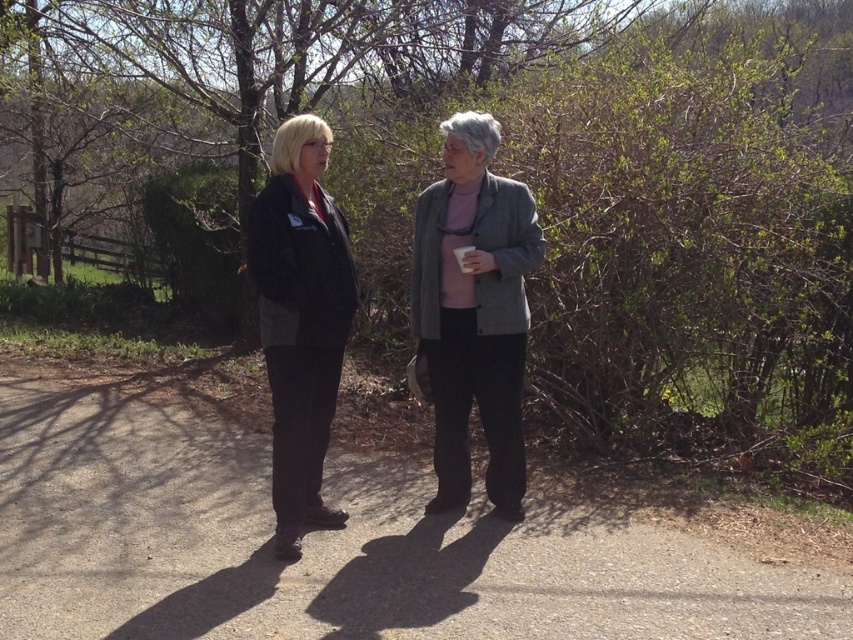
Question: Which point is farther to the camera?

Choices:
 (A) black matte suit at center
 (B) gray woolen blazer at center
 (C) gray asphalt path at center

Answer: (B)

Question: In this image, where is gray asphalt path at center located relative to black matte suit at center?

Choices:
 (A) left
 (B) right

Answer: (B)

Question: Is gray woolen blazer at center thinner than black matte suit at center?

Choices:
 (A) no
 (B) yes

Answer: (A)

Question: Among these points, which one is nearest to the camera?

Choices:
 (A) (16, 422)
 (B) (306, 522)

Answer: (B)

Question: Does gray asphalt path at center appear over gray woolen blazer at center?

Choices:
 (A) no
 (B) yes

Answer: (A)

Question: Which of the following is the closest to the observer?

Choices:
 (A) (450, 557)
 (B) (461, 352)
 (C) (279, 305)

Answer: (C)